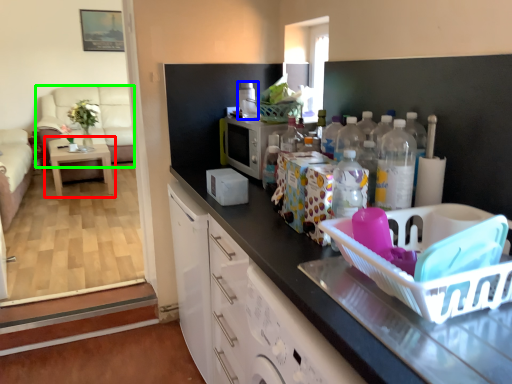
Question: Based on their relative distances, which object is farther from table (highlighted by a red box)? Choose from appliance (highlighted by a blue box) and couch (highlighted by a green box).

Choices:
 (A) appliance
 (B) couch

Answer: (A)